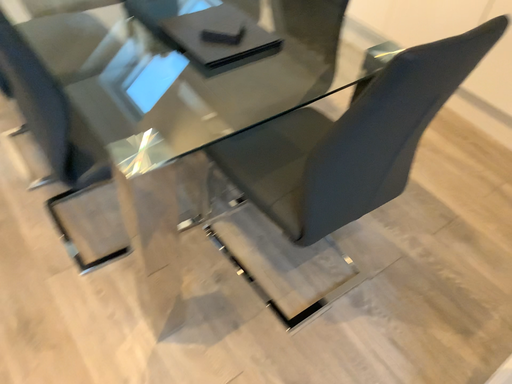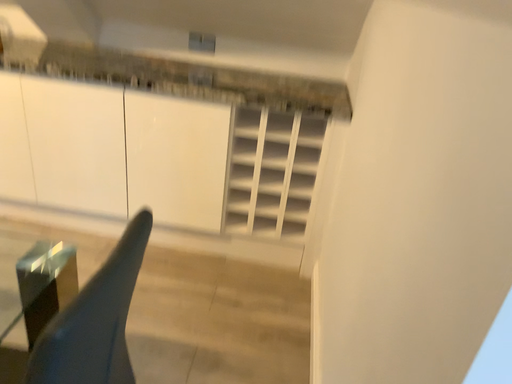
Question: How did the camera likely rotate when shooting the video?

Choices:
 (A) rotated upward
 (B) rotated downward

Answer: (A)